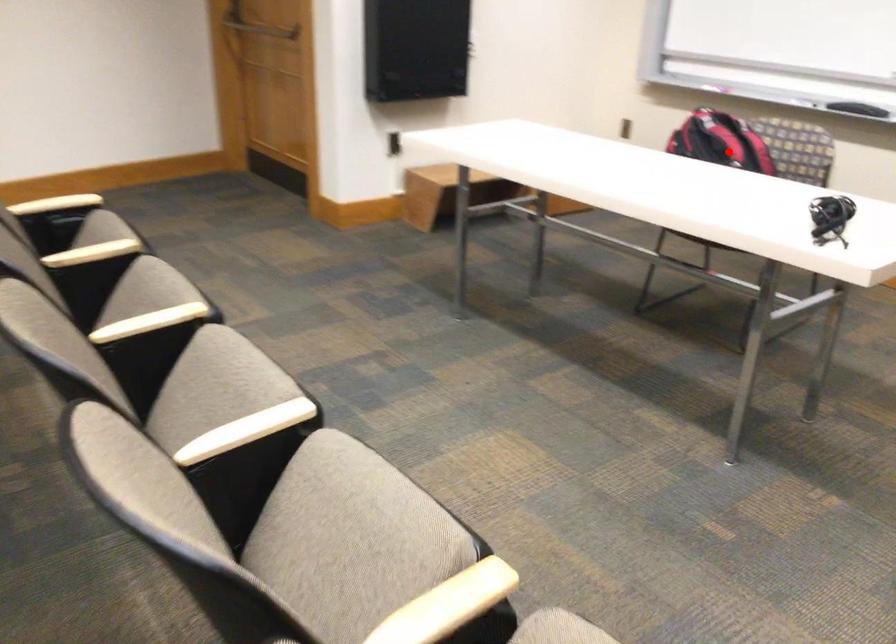
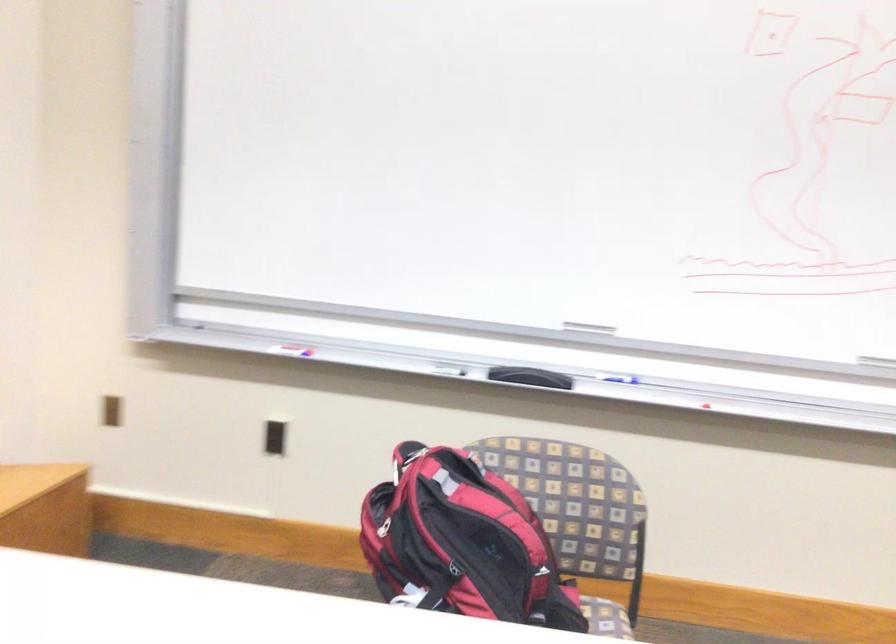
Where in the second image is the point corresponding to the highlighted location from the first image?

(478, 542)